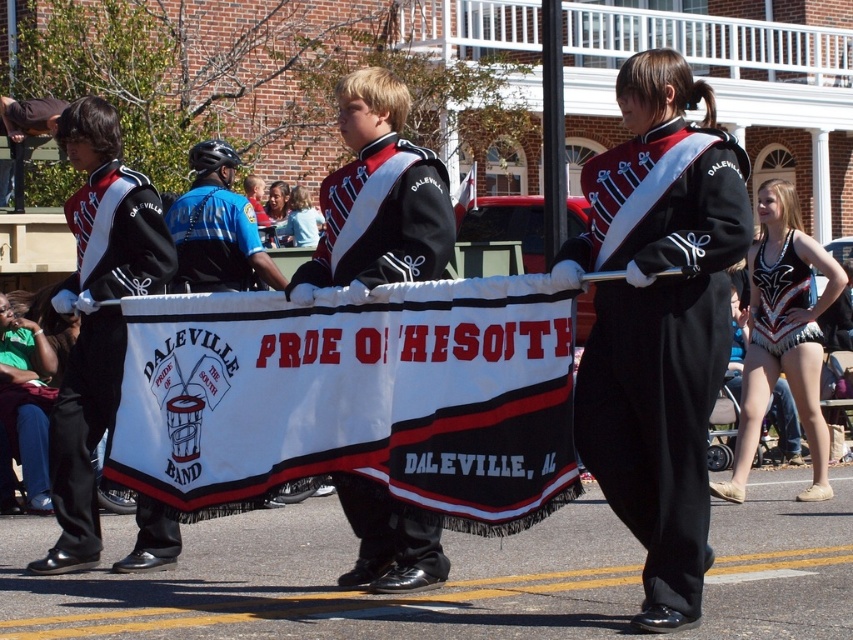
Question: Which point is farther from the camera taking this photo?

Choices:
 (A) (662, 436)
 (B) (173, 273)

Answer: (B)

Question: Does white fabric banner at center appear on the right side of black satin jacket at center?

Choices:
 (A) no
 (B) yes

Answer: (A)

Question: Does black satin jacket at center lie in front of black spandex leotard at right?

Choices:
 (A) no
 (B) yes

Answer: (B)

Question: Estimate the real-world distances between objects in this image. Which object is closer to the matte black uniform at center?

Choices:
 (A) matte black uniform at left
 (B) blue fabric shirt at upper left
 (C) black spandex leotard at right
 (D) black satin jacket at center

Answer: (D)

Question: Can you confirm if matte black uniform at center is thinner than black satin jacket at center?

Choices:
 (A) no
 (B) yes

Answer: (A)

Question: Estimate the real-world distances between objects in this image. Which object is closer to the white fabric banner at center?

Choices:
 (A) black spandex leotard at right
 (B) blue fabric shirt at upper left

Answer: (B)